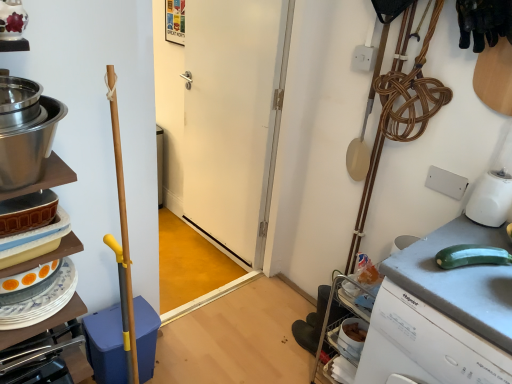
Find the location of `blue plastic dish washer at left`. blue plastic dish washer at left is located at coordinates (106, 345).

Measure the distance between point (20, 173) and camera.

Point (20, 173) is 88.60 centimeters from camera.

This screenshot has width=512, height=384. What are the coordinates of `gray matte countertop at right` in the screenshot? It's located at (459, 280).

Locate an element on the screen. The height and width of the screenshot is (384, 512). blue plastic dish washer at left is located at coordinates (106, 345).

Is point (257, 99) behind point (147, 378)?

Yes, it is behind point (147, 378).

Can you confirm if white matte door at center is taller than blue plastic dish washer at left?

Yes, white matte door at center is taller than blue plastic dish washer at left.

Is white matte door at center facing away from blue plastic dish washer at left?

No, white matte door at center is not facing away from blue plastic dish washer at left.

Based on the photo, from a real-world perspective, who is located lower, white matte door at center or blue plastic dish washer at left?

blue plastic dish washer at left is physically lower.

Does point (73, 240) come farther from viewer compared to point (447, 310)?

Yes, point (73, 240) is behind point (447, 310).

Considering the relative sizes of matte ceramic dishes at left and gray matte countertop at right in the image provided, is matte ceramic dishes at left shorter than gray matte countertop at right?

Correct, matte ceramic dishes at left is not as tall as gray matte countertop at right.

The height and width of the screenshot is (384, 512). What are the coordinates of `counter top below the matte ceramic dishes at left (from a real-world perspective)` in the screenshot? It's located at (459, 280).

From the picture: From a real-world perspective, is matte ceramic dishes at left positioned under gray matte countertop at right based on gravity?

No, from a real-world perspective, matte ceramic dishes at left is not under gray matte countertop at right.

Consider the image. Is gray matte countertop at right far away from blue plastic dish washer at left?

Yes, gray matte countertop at right and blue plastic dish washer at left are located far from each other.

Is point (493, 335) closer to viewer compared to point (106, 366)?

Yes, it is in front of point (106, 366).

From the image's perspective, is gray matte countertop at right located beneath blue plastic dish washer at left?

No, from the image's perspective, gray matte countertop at right is not beneath blue plastic dish washer at left.

Locate an element on the screen. dish washer located below the gray matte countertop at right (from the image's perspective) is located at coordinates (106, 345).

Considering their positions, is gray matte countertop at right located in front of or behind stainless steel bowl at left?

gray matte countertop at right is positioned farther from the viewer than stainless steel bowl at left.

Does gray matte countertop at right turn towards stainless steel bowl at left?

No, gray matte countertop at right is not aimed at stainless steel bowl at left.

From a real-world perspective, which is physically below, gray matte countertop at right or stainless steel bowl at left?

gray matte countertop at right, from a real-world perspective.

Is gray matte countertop at right located outside stainless steel bowl at left?

Yes, gray matte countertop at right is not within stainless steel bowl at left.

Find the location of a particular element. kitchen appliance above the matte ceramic dishes at left (from the image's perspective) is located at coordinates (29, 146).

From the image's perspective, between stainless steel bowl at left and matte ceramic dishes at left, who is located below?

matte ceramic dishes at left is shown below in the image.

Could you tell me if stainless steel bowl at left is facing matte ceramic dishes at left?

No, stainless steel bowl at left is not aimed at matte ceramic dishes at left.

Is stainless steel bowl at left shorter than matte ceramic dishes at left?

No, stainless steel bowl at left is not shorter than matte ceramic dishes at left.

Looking at this image, is blue plastic dish washer at left positioned with its back to stainless steel bowl at left?

No.

Between blue plastic dish washer at left and stainless steel bowl at left, which one has larger size?

blue plastic dish washer at left.

Which is closer to the camera, (149, 327) or (40, 118)?

Point (149, 327) is positioned farther from the camera compared to point (40, 118).

From the image's perspective, which is above, white matte door at center or matte ceramic dishes at left?

From the image's view, white matte door at center is above.

Which is nearer, (x=231, y=101) or (x=28, y=335)?

Clearly, point (x=231, y=101) is more distant from the camera than point (x=28, y=335).

Can you confirm if white matte door at center is shorter than matte ceramic dishes at left?

No.

Considering the positions of objects white matte door at center and matte ceramic dishes at left in the image provided, who is in front, white matte door at center or matte ceramic dishes at left?

matte ceramic dishes at left is closer to the camera.

Identify the location of door that appears on the right of blue plastic dish washer at left. The height and width of the screenshot is (384, 512). (224, 118).

Where is `shelf above the gray matte countertop at right (from a real-world perspective)`? The height and width of the screenshot is (384, 512). shelf above the gray matte countertop at right (from a real-world perspective) is located at coordinates (42, 323).

Which object lies nearer to the anchor point stainless steel bowl at left, blue plastic dish washer at left or matte ceramic dishes at left?

Based on the image, matte ceramic dishes at left appears to be nearer to stainless steel bowl at left.

From the image, which object appears to be nearer to gray matte countertop at right, matte ceramic dishes at left or stainless steel bowl at left?

Based on the image, matte ceramic dishes at left appears to be nearer to gray matte countertop at right.

When comparing their distances from matte ceramic dishes at left, does gray matte countertop at right or white matte door at center seem further?

Among the two, white matte door at center is located further to matte ceramic dishes at left.

When comparing their distances from blue plastic dish washer at left, does matte ceramic dishes at left or stainless steel bowl at left seem further?

Among the two, stainless steel bowl at left is located further to blue plastic dish washer at left.

Considering their positions, is gray matte countertop at right positioned further to white matte door at center than stainless steel bowl at left?

gray matte countertop at right.

Based on their spatial positions, is matte ceramic dishes at left or white matte door at center further from gray matte countertop at right?

white matte door at center is further to gray matte countertop at right.

Which object lies further to the anchor point white matte door at center, gray matte countertop at right or blue plastic dish washer at left?

Among the two, gray matte countertop at right is located further to white matte door at center.

From the image, which object appears to be farther from gray matte countertop at right, blue plastic dish washer at left or matte ceramic dishes at left?

Based on the image, blue plastic dish washer at left appears to be further to gray matte countertop at right.

I want to click on shelf between stainless steel bowl at left and blue plastic dish washer at left from front to back, so click(x=42, y=323).

You are a GUI agent. You are given a task and a screenshot of the screen. Output one action in this format:
    pyautogui.click(x=<x>, y=<y>)
    Task: Click on the shelf between white matte door at center and blue plastic dish washer at left from top to bottom
    
    Given the screenshot: What is the action you would take?
    pyautogui.click(x=42, y=323)

The height and width of the screenshot is (384, 512). Find the location of `door between stainless steel bowl at left and gray matte countertop at right in the horizontal direction`. door between stainless steel bowl at left and gray matte countertop at right in the horizontal direction is located at coordinates (224, 118).

Image resolution: width=512 pixels, height=384 pixels. What are the coordinates of `door situated between blue plastic dish washer at left and gray matte countertop at right from left to right` in the screenshot? It's located at (224, 118).